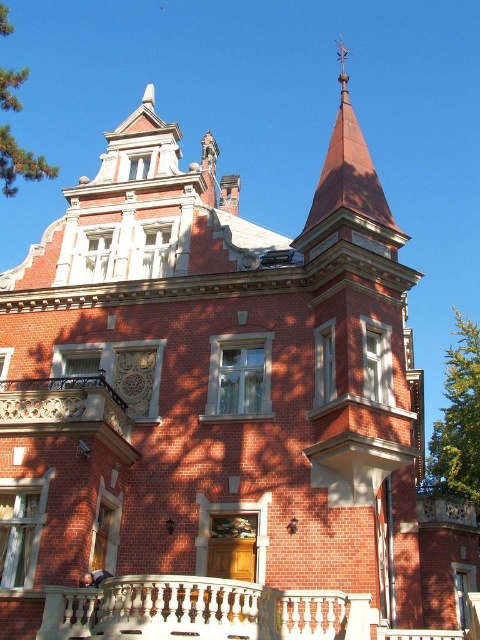
Question: Can you confirm if green leafy tree at right is bigger than green leafy tree at upper left?

Choices:
 (A) no
 (B) yes

Answer: (A)

Question: Among these points, which one is farthest from the camera?

Choices:
 (A) (311, 627)
 (B) (460, 390)

Answer: (B)

Question: Among these points, which one is farthest from the camera?

Choices:
 (A) (466, 384)
 (B) (369, 189)
 (C) (111, 424)

Answer: (A)

Question: Can you confirm if rustic wood balcony at center is bigger than rusty metal spire at upper center?

Choices:
 (A) yes
 (B) no

Answer: (B)

Question: Can you confirm if rustic wood balcony at center is smaller than green leafy tree at upper left?

Choices:
 (A) no
 (B) yes

Answer: (B)

Question: Among these points, which one is nearest to the camera?

Choices:
 (A) (9, 156)
 (B) (324, 179)
 (C) (448, 442)

Answer: (B)